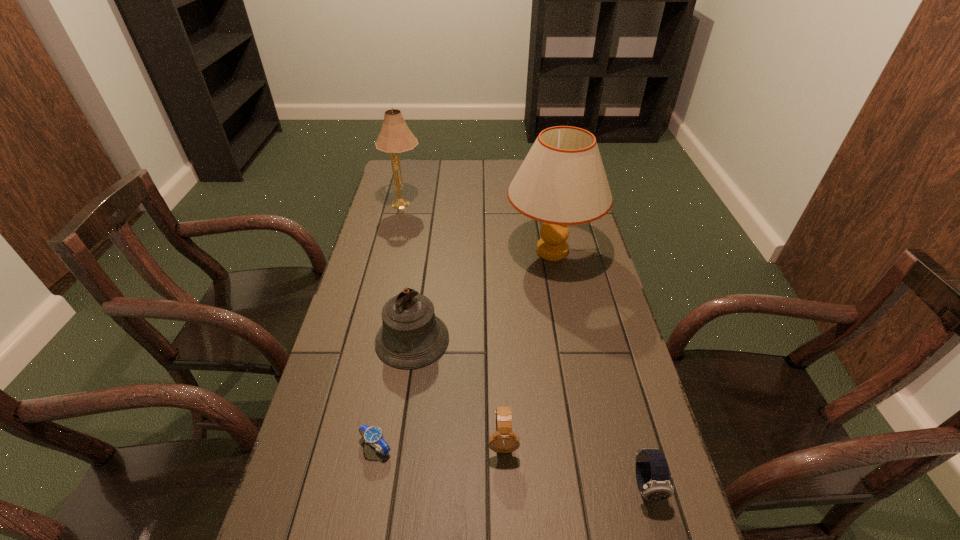
I want to click on the shortest object, so click(373, 435).

This screenshot has width=960, height=540. Identify the location of blank space located 0.380m on the left of the right lampshade. [396, 251].

The image size is (960, 540). Find the location of `free space located on the right of the farthest object`. free space located on the right of the farthest object is located at coordinates (487, 204).

At what (x,y) coordinates should I click in order to perform the action: click on free space located on the front of the fourth nearest object. Please return your answer as a coordinate pair (x, y). Image resolution: width=960 pixels, height=540 pixels. Looking at the image, I should click on (402, 406).

You are a GUI agent. You are given a task and a screenshot of the screen. Output one action in this format:
    pyautogui.click(x=<x>, y=<y>)
    Task: Click on the vacant region located on the face of the second watch from left to right
    
    Given the screenshot: What is the action you would take?
    pyautogui.click(x=506, y=510)

At what (x,y) coordinates should I click in order to perform the action: click on free location located on the front of the shortest object. Please return your answer as a coordinate pair (x, y). This screenshot has width=960, height=540. Looking at the image, I should click on (366, 501).

Where is `lampshade positioned at the left edge`? The width and height of the screenshot is (960, 540). lampshade positioned at the left edge is located at coordinates (395, 137).

This screenshot has height=540, width=960. In order to click on bell located at the left edge in this screenshot , I will do `click(411, 336)`.

Locate an element on the screen. This screenshot has width=960, height=540. watch that is at the left edge is located at coordinates (373, 435).

Where is `lampshade that is at the right edge`? The image size is (960, 540). lampshade that is at the right edge is located at coordinates (562, 181).